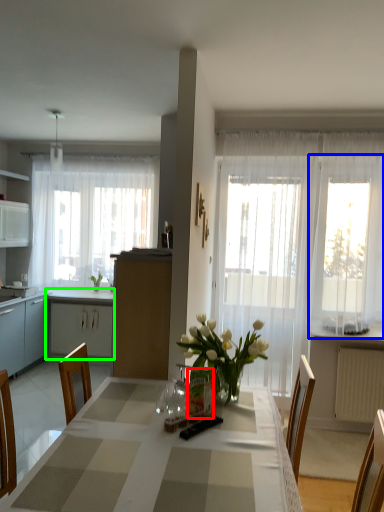
Question: Considering the real-world distances, which object is closest to vase (highlighted by a red box)? window (highlighted by a blue box) or cabinetry (highlighted by a green box).

Choices:
 (A) window
 (B) cabinetry

Answer: (A)